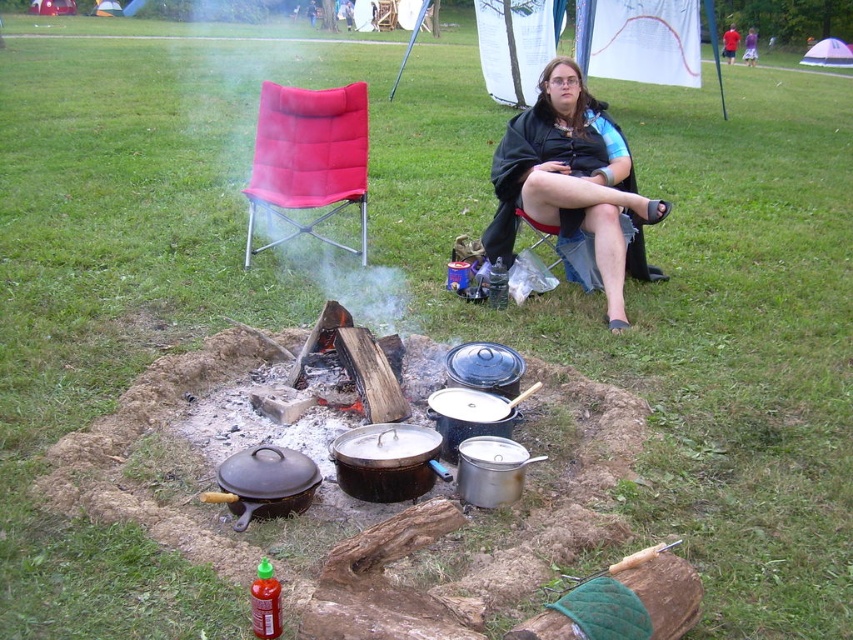
What is the exact location of the black fabric cape at center in the image?

The black fabric cape at center is located at point coordinates of (572, 180).

You are a hiker who wants to sit down near the fire pit. You see the black fabric cape at center and the red fabric folding chair at center. Which object is closer to your right side if you face the fire pit?

The black fabric cape at center is positioned on the right side of red fabric folding chair at center, so if you face the fire pit, the black fabric cape at center would be on your right side.

You are a hiker who needs to cover your backpack with a fabric item from the scene. Which item would you choose between the black fabric cape at center and the red fabric folding chair at center?

The black fabric cape at center is larger in size than the red fabric folding chair at center, so it would be better to use the black fabric cape at center to cover your backpack since it is bigger and more suitable for covering purposes.